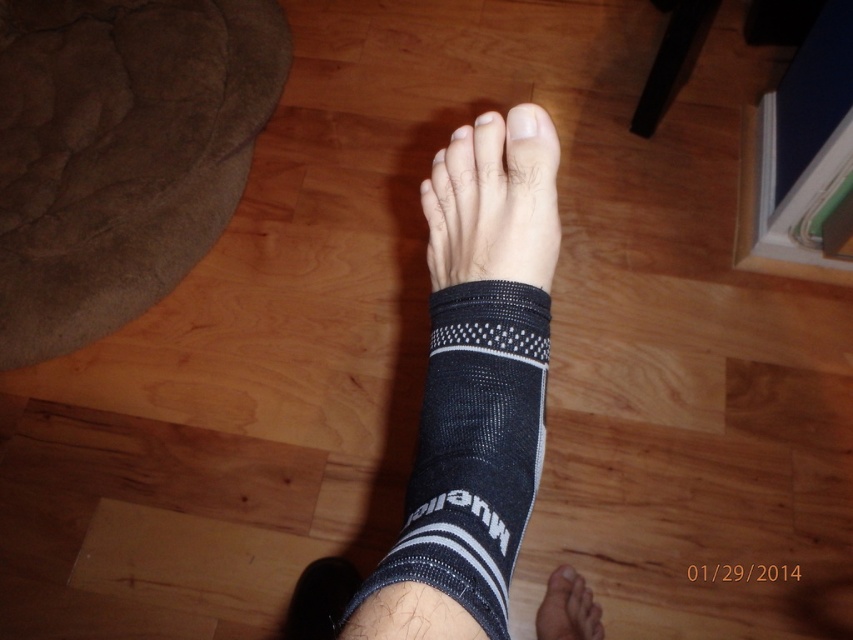
Question: Which point is closer to the camera?

Choices:
 (A) [479, 120]
 (B) [527, 108]

Answer: (B)

Question: Can you confirm if black mesh sock at lower center is positioned above white matte nail at center?

Choices:
 (A) no
 (B) yes

Answer: (A)

Question: Which point appears closest to the camera in this image?

Choices:
 (A) (521, 112)
 (B) (482, 346)
 (C) (462, 131)
 (D) (595, 628)

Answer: (B)

Question: Is black mesh sock at center above white matte toe at center?

Choices:
 (A) yes
 (B) no

Answer: (B)

Question: Estimate the real-world distances between objects in this image. Which object is closer to the white matte nail at upper center?

Choices:
 (A) white matte nail at center
 (B) white matte toe at center

Answer: (B)

Question: Can you confirm if white matte nail at upper center is positioned to the left of white matte nail at center?

Choices:
 (A) yes
 (B) no

Answer: (B)